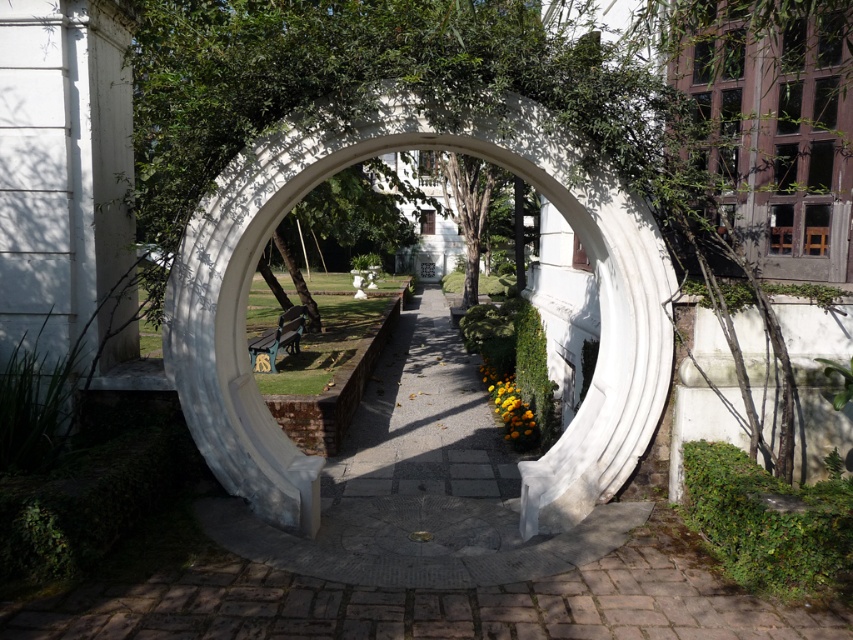
Question: Which point is farther from the camera taking this photo?

Choices:
 (A) (201, 412)
 (B) (814, 609)

Answer: (A)

Question: Among these objects, which one is farthest from the camera?

Choices:
 (A) white stone path at center
 (B) white stone archway at center

Answer: (B)

Question: Can you confirm if white stone path at center is wider than white stone archway at center?

Choices:
 (A) yes
 (B) no

Answer: (A)

Question: Is white stone path at center above white stone archway at center?

Choices:
 (A) no
 (B) yes

Answer: (A)

Question: Can you confirm if white stone path at center is positioned to the left of white stone archway at center?

Choices:
 (A) no
 (B) yes

Answer: (A)

Question: Which point appears closest to the camera in this image?

Choices:
 (A) (196, 614)
 (B) (650, 212)

Answer: (A)